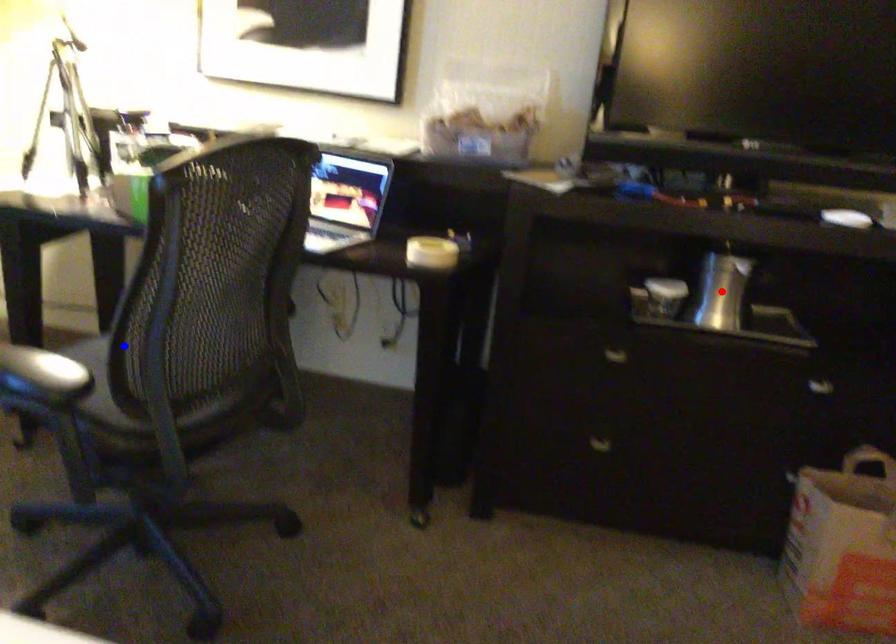
Question: In the image, two points are highlighted. Which point is nearer to the camera? Reply with the corresponding letter.

Choices:
 (A) blue point
 (B) red point

Answer: (A)